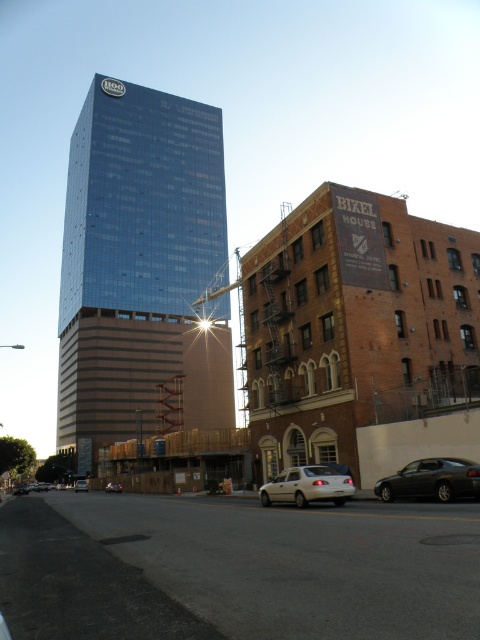
Question: Can you confirm if metallic gray sedan at lower right is positioned to the right of white matte sedan at lower center?

Choices:
 (A) no
 (B) yes

Answer: (B)

Question: Which point is farther from the camera taking this photo?

Choices:
 (A) (292, 499)
 (B) (87, 486)
 (C) (28, 490)

Answer: (C)

Question: Which point appears closest to the camera in this image?

Choices:
 (A) (74, 488)
 (B) (264, 488)
 (C) (26, 486)

Answer: (B)

Question: Which point is closer to the camera?

Choices:
 (A) silver metallic sedan at center
 (B) metallic gray sedan at lower right
 (C) shiny glass skyscraper at center
 (D) silver metallic sedan at lower left

Answer: (B)

Question: Is shiny glass skyscraper at center smaller than metallic gray sedan at lower right?

Choices:
 (A) yes
 (B) no

Answer: (B)

Question: Is white matte sedan at lower center in front of silver metallic sedan at center?

Choices:
 (A) no
 (B) yes

Answer: (B)